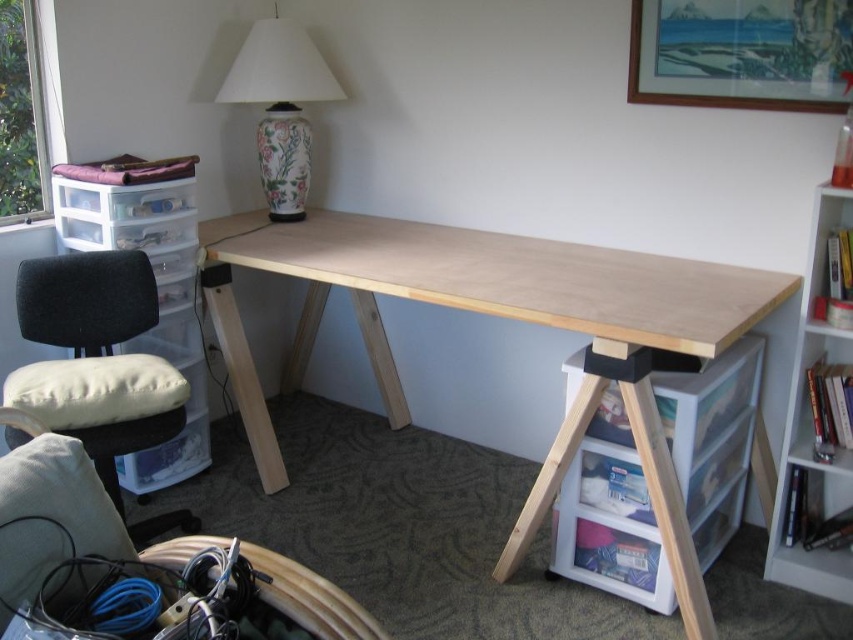
Does natural wood table at center have a lesser width compared to white wood bookshelf at right?

In fact, natural wood table at center might be wider than white wood bookshelf at right.

Between point (743, 328) and point (804, 301), which one is positioned in front?

Point (743, 328) is in front.

Between point (350, 212) and point (788, 404), which one is positioned behind?

Point (350, 212)

Locate an element on the screen. This screenshot has height=640, width=853. natural wood table at center is located at coordinates (502, 316).

Does point (457, 291) come behind point (306, 125)?

That is False.

Looking at this image, does natural wood table at center have a lesser width compared to porcelain floral lamp at upper center?

No, natural wood table at center is not thinner than porcelain floral lamp at upper center.

Does point (711, 337) come behind point (273, 44)?

No, it is not.

This screenshot has height=640, width=853. Find the location of `natural wood table at center`. natural wood table at center is located at coordinates (502, 316).

Who is more forward, (537, 272) or (102, 474)?

Point (102, 474) is more forward.

Is natural wood table at center bigger than velvet black swivel chair at left?

Yes, natural wood table at center is bigger than velvet black swivel chair at left.

Is point (566, 262) closer to camera compared to point (77, 314)?

That is False.

In order to click on natural wood table at center in this screenshot , I will do `click(502, 316)`.